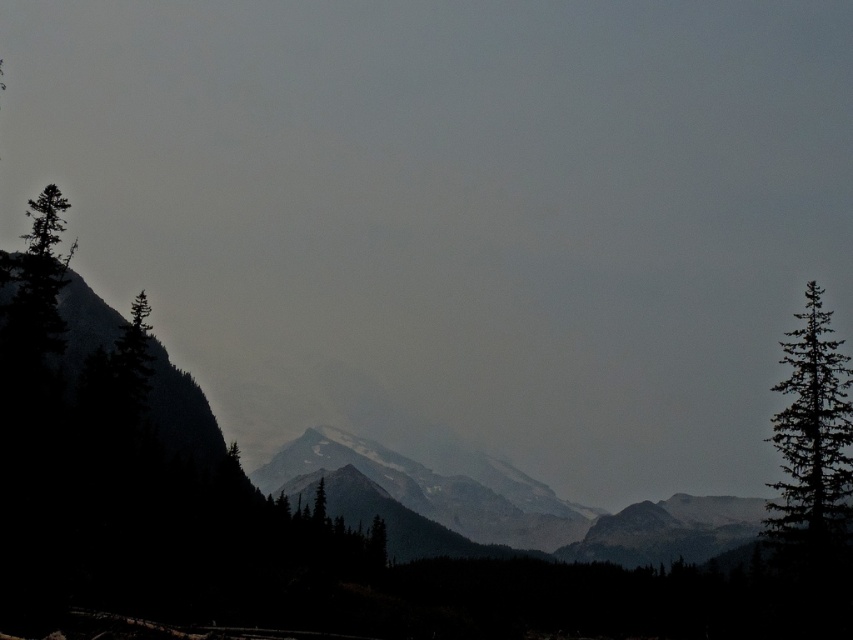
Can you confirm if green matte tree at right is smaller than green matte tree at left?

Yes, green matte tree at right is smaller than green matte tree at left.

Is green matte tree at right taller than green matte tree at left?

Correct, green matte tree at right is much taller as green matte tree at left.

You are a GUI agent. You are given a task and a screenshot of the screen. Output one action in this format:
    pyautogui.click(x=<x>, y=<y>)
    Task: Click on the green matte tree at right
    This screenshot has width=853, height=640.
    Given the screenshot: What is the action you would take?
    pyautogui.click(x=811, y=440)

Locate an element on the screen. This screenshot has width=853, height=640. green matte tree at right is located at coordinates (811, 440).

From the picture: Between snowy granite mountain range at center and green matte tree at left, which one appears on the right side from the viewer's perspective?

From the viewer's perspective, snowy granite mountain range at center appears more on the right side.

Is snowy granite mountain range at center below green matte tree at left?

Yes, snowy granite mountain range at center is below green matte tree at left.

Which is in front, point (532, 545) or point (27, 250)?

Point (27, 250) is in front.

Locate an element on the screen. snowy granite mountain range at center is located at coordinates (498, 508).

Between green matte tree at right and green matte tree at center, which one is positioned higher?

green matte tree at right is higher up.

What do you see at coordinates (811, 440) in the screenshot?
I see `green matte tree at right` at bounding box center [811, 440].

Which is behind, point (828, 502) or point (322, 483)?

The point (322, 483) is behind.

I want to click on green matte tree at right, so click(x=811, y=440).